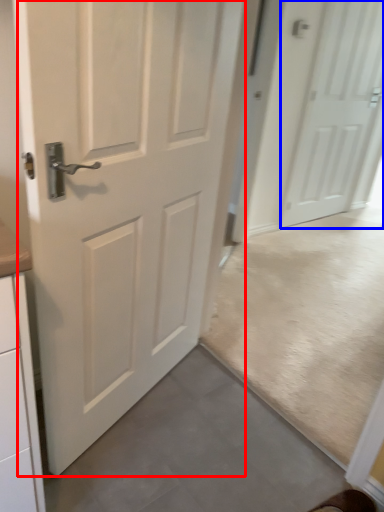
Question: Which point is further to the camera, door (highlighted by a red box) or door (highlighted by a blue box)?

Choices:
 (A) door
 (B) door

Answer: (B)